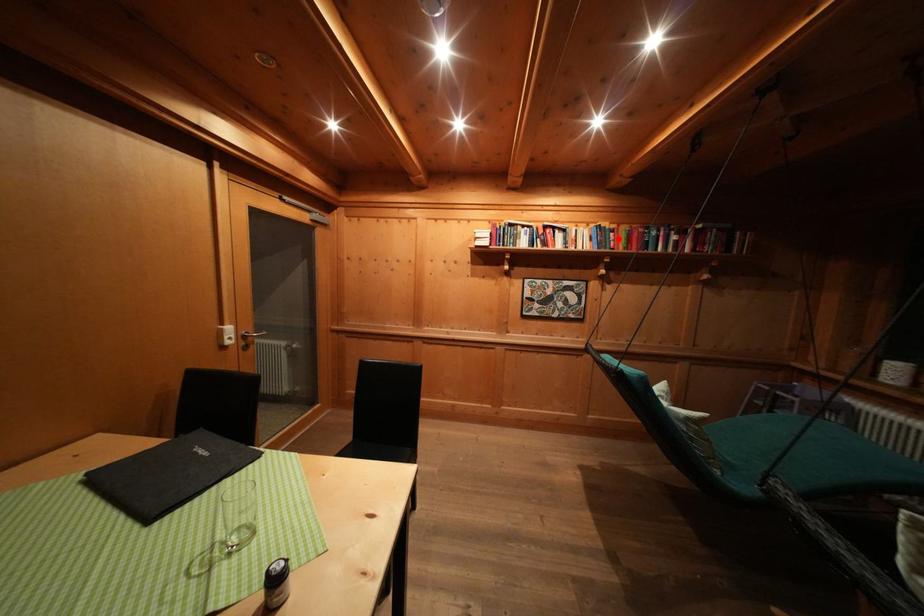
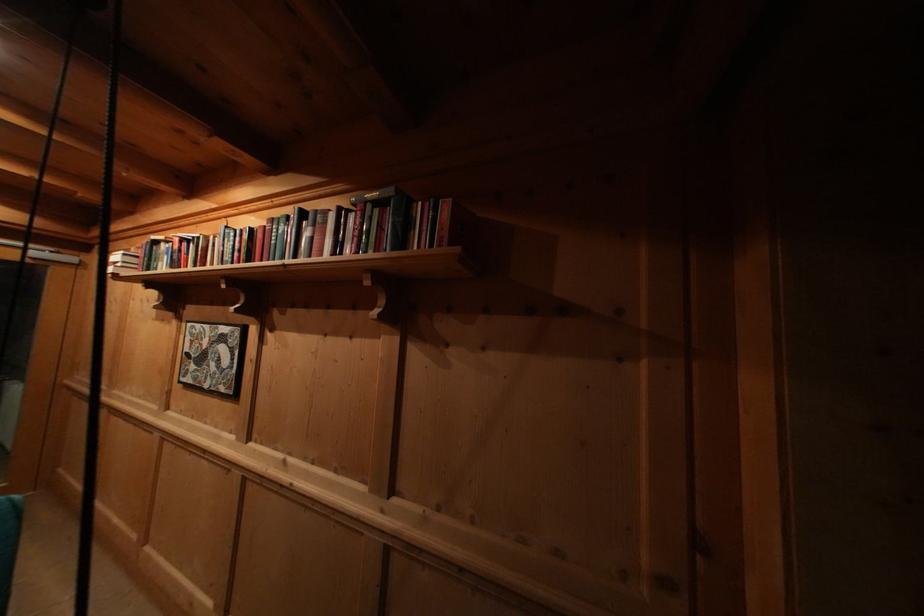
Locate, in the second image, the point that corresponds to the highlighted location in the first image.

(244, 245)